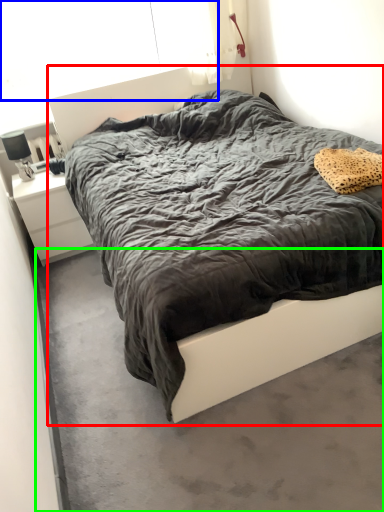
Question: Considering the real-world distances, which object is closest to bed (highlighted by a red box)? window screen (highlighted by a blue box) or concrete (highlighted by a green box).

Choices:
 (A) window screen
 (B) concrete

Answer: (B)